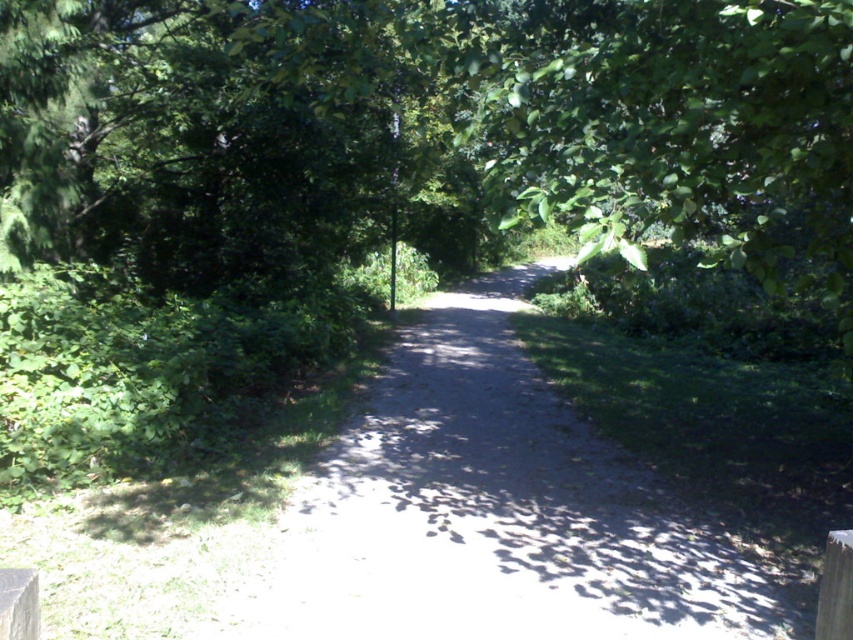
Image resolution: width=853 pixels, height=640 pixels. I want to click on brown wooden post at lower right, so click(x=834, y=588).

In the scene shown: Can you confirm if brown wooden post at lower right is positioned above smooth gray wood at lower left?

No, brown wooden post at lower right is not above smooth gray wood at lower left.

Who is more distant from viewer, [830,552] or [28,618]?

The point [830,552] is behind.

Locate an element on the screen. This screenshot has height=640, width=853. brown wooden post at lower right is located at coordinates (834, 588).

Which is more to the left, dirt path at center or smooth gray wood at lower left?

smooth gray wood at lower left is more to the left.

Looking at this image, is dirt path at center to the left of smooth gray wood at lower left from the viewer's perspective?

In fact, dirt path at center is to the right of smooth gray wood at lower left.

Between point (492, 275) and point (28, 582), which one is positioned behind?

The point (492, 275) is more distant.

You are a GUI agent. You are given a task and a screenshot of the screen. Output one action in this format:
    pyautogui.click(x=<x>, y=<y>)
    Task: Click on the dirt path at center
    
    Given the screenshot: What is the action you would take?
    pyautogui.click(x=494, y=512)

Which of these two, dirt path at center or brown wooden post at lower right, stands taller?

dirt path at center is taller.

Is dirt path at center smaller than brown wooden post at lower right?

No, dirt path at center is not smaller than brown wooden post at lower right.

The width and height of the screenshot is (853, 640). Identify the location of dirt path at center. (494, 512).